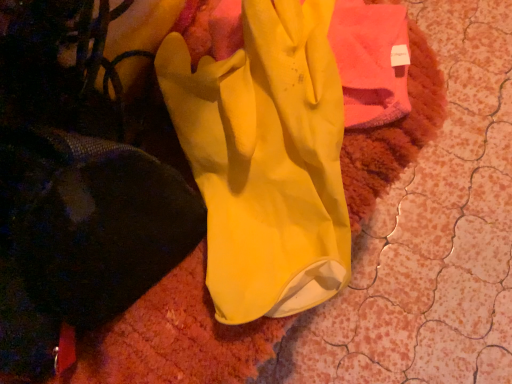
Image resolution: width=512 pixels, height=384 pixels. Describe the element at coordinates (266, 159) in the screenshot. I see `yellow rubber glove at center` at that location.

What is the approximate width of yellow rubber glove at center?

The width of yellow rubber glove at center is 7.00 inches.

Where is `yellow rubber glove at center`? This screenshot has width=512, height=384. yellow rubber glove at center is located at coordinates pos(266,159).

Find the location of `yellow rubber glove at center`. yellow rubber glove at center is located at coordinates (266, 159).